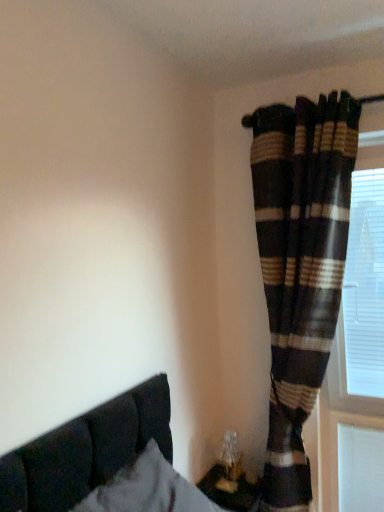
Question: Is white plastic blinds at right bigger or smaller than suede-like dark brown bed at lower left?

Choices:
 (A) small
 (B) big

Answer: (A)

Question: Is white plastic blinds at right to the left or to the right of suede-like dark brown bed at lower left in the image?

Choices:
 (A) left
 (B) right

Answer: (B)

Question: Which object is positioned farthest from the suede-like dark brown bed at lower left?

Choices:
 (A) plaid fabric curtain at right
 (B) white plastic blinds at right

Answer: (B)

Question: Estimate the real-world distances between objects in this image. Which object is farther from the white plastic blinds at right?

Choices:
 (A) suede-like dark brown bed at lower left
 (B) plaid fabric curtain at right

Answer: (A)